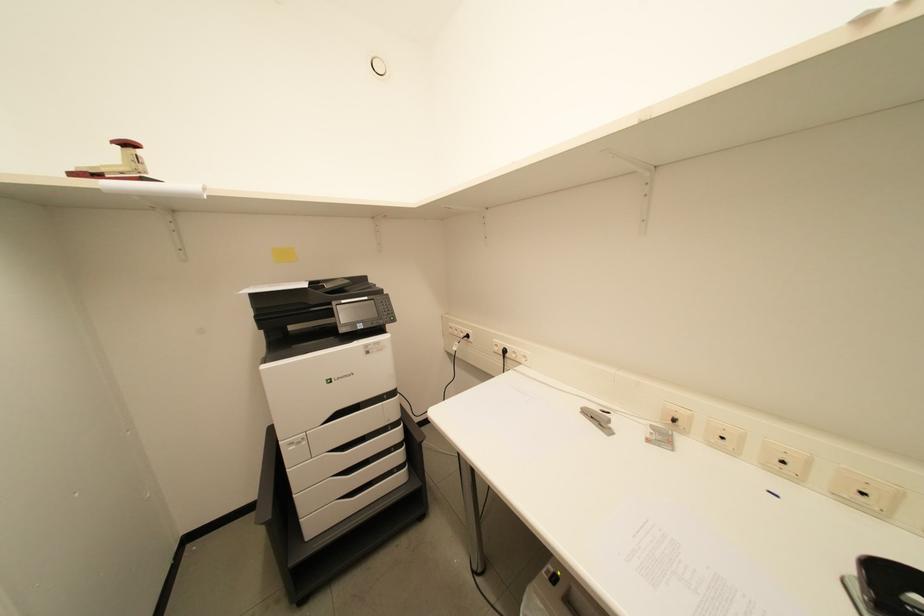
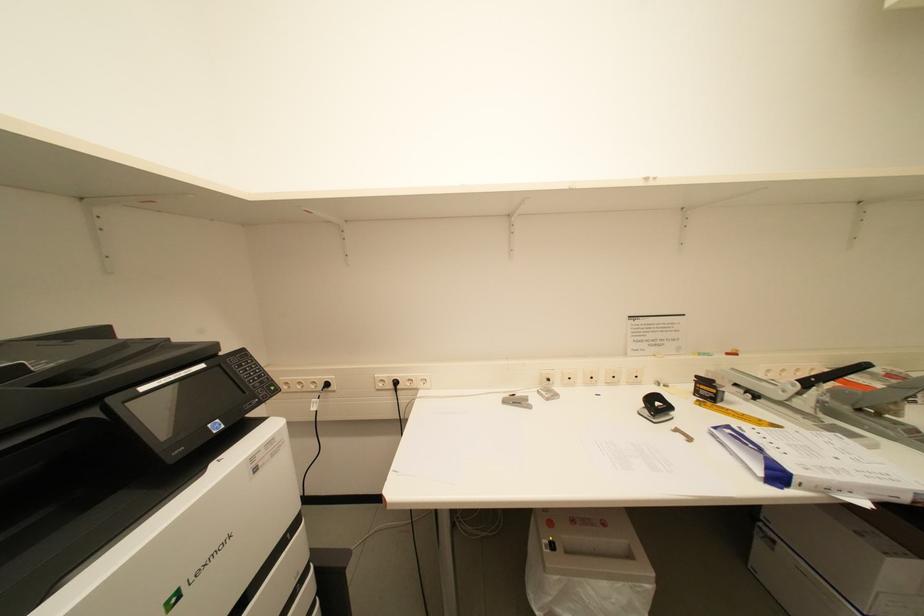
Question: The camera is either moving clockwise (left) or counter-clockwise (right) around the object. The first image is from the beginning of the video and the second image is from the end. Is the camera moving left or right when shooting the video?

Choices:
 (A) Left
 (B) Right

Answer: (A)